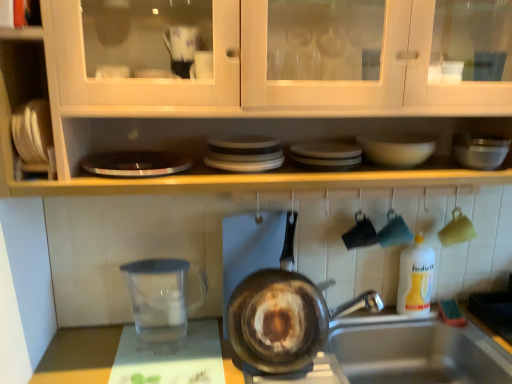
What is the approximate height of rusty metal frying pan at center?

It is 16.28 inches.

This screenshot has width=512, height=384. I want to click on rusty metal frying pan at center, so click(276, 298).

Locate an element on the screen. This screenshot has width=512, height=384. white plastic bottle at right is located at coordinates (415, 278).

This screenshot has height=384, width=512. What are the coordinates of `silver metallic sink at lower right` in the screenshot? It's located at (418, 353).

Locate an element on the screen. The width and height of the screenshot is (512, 384). metallic silver mixing bowl at upper right is located at coordinates 480,150.

What do you see at coordinates (164, 296) in the screenshot? I see `transparent plastic measuring cup at lower left` at bounding box center [164, 296].

Locate an element on the screen. The height and width of the screenshot is (384, 512). transparent plastic measuring cup at lower left is located at coordinates (164, 296).

Locate an element on the screen. This screenshot has height=384, width=512. transparent glass water at lower left is located at coordinates (79, 356).

Locate an element on the screen. white glossy bowl at upper center is located at coordinates (397, 148).

Identify the location of rusty metal frying pan at center. (276, 298).

Looking at this image, which is correct: silver metallic sink at lower right is inside transparent glass water at lower left, or outside of it?

silver metallic sink at lower right is not inside transparent glass water at lower left, it's outside.

Is silver metallic sink at lower right touching transparent glass water at lower left?

There is a gap between silver metallic sink at lower right and transparent glass water at lower left.

Which object is further away from the camera taking this photo, silver metallic sink at lower right or transparent glass water at lower left?

transparent glass water at lower left.

From the image's perspective, is silver metallic sink at lower right on transparent glass water at lower left?

No, from the image's perspective, silver metallic sink at lower right is not above transparent glass water at lower left.

Which of these two, white glossy bowl at upper center or transparent plastic measuring cup at lower left, is thinner?

white glossy bowl at upper center is thinner.

Could transparent plastic measuring cup at lower left be considered to be inside white glossy bowl at upper center?

No, transparent plastic measuring cup at lower left is not surrounded by white glossy bowl at upper center.

Does point (405, 145) come behind point (157, 270)?

No, (405, 145) is in front of (157, 270).

From the image's perspective, which object appears higher, transparent plastic measuring cup at lower left or white glossy bowl at upper center?

white glossy bowl at upper center.

From a real-world perspective, which is physically below, transparent plastic measuring cup at lower left or white glossy bowl at upper center?

transparent plastic measuring cup at lower left is physically lower.

Can you confirm if transparent plastic measuring cup at lower left is thinner than white glossy bowl at upper center?

In fact, transparent plastic measuring cup at lower left might be wider than white glossy bowl at upper center.

Does transparent plastic measuring cup at lower left lie behind white glossy bowl at upper center?

No, it is in front of white glossy bowl at upper center.

In the image, is white glossy bowl at upper center positioned in front of or behind transparent glass water at lower left?

Clearly, white glossy bowl at upper center is behind transparent glass water at lower left.

What's the angular difference between white glossy bowl at upper center and transparent glass water at lower left's facing directions?

The facing directions of white glossy bowl at upper center and transparent glass water at lower left are 0.954 degrees apart.

From the image's perspective, which one is positioned lower, white glossy bowl at upper center or transparent glass water at lower left?

transparent glass water at lower left, from the image's perspective.

Locate an element on the screen. The width and height of the screenshot is (512, 384). counter top beneath the white glossy bowl at upper center (from a real-world perspective) is located at coordinates (79, 356).

Is rusty metal frying pan at center oriented away from transparent glass water at lower left?

rusty metal frying pan at center is not turned away from transparent glass water at lower left.

From the image's perspective, is rusty metal frying pan at center on transparent glass water at lower left?

Indeed, from the image's perspective, rusty metal frying pan at center is shown above transparent glass water at lower left.

Is rusty metal frying pan at center not within transparent glass water at lower left?

Yes, rusty metal frying pan at center is outside of transparent glass water at lower left.

Considering the sizes of objects rusty metal frying pan at center and transparent plastic measuring cup at lower left in the image provided, who is thinner, rusty metal frying pan at center or transparent plastic measuring cup at lower left?

Thinner between the two is transparent plastic measuring cup at lower left.

Considering the positions of objects rusty metal frying pan at center and transparent plastic measuring cup at lower left in the image provided, who is behind, rusty metal frying pan at center or transparent plastic measuring cup at lower left?

transparent plastic measuring cup at lower left is further away from the camera.

From a real-world perspective, is rusty metal frying pan at center located higher than transparent plastic measuring cup at lower left?

Yes, from a real-world perspective, rusty metal frying pan at center is over transparent plastic measuring cup at lower left

You are a GUI agent. You are given a task and a screenshot of the screen. Output one action in this format:
    pyautogui.click(x=<x>, y=<y>)
    Task: Click on the frying pan on the right of the transparent plastic measuring cup at lower left
    This screenshot has height=384, width=512.
    Given the screenshot: What is the action you would take?
    pyautogui.click(x=276, y=298)

Locate an element on the screen. counter top located underneath the transparent plastic measuring cup at lower left (from a real-world perspective) is located at coordinates (79, 356).

In the scene shown: Relative to transparent glass water at lower left, is transparent plastic measuring cup at lower left in front or behind?

Visually, transparent plastic measuring cup at lower left is located behind transparent glass water at lower left.

How distant is transparent plastic measuring cup at lower left from transparent glass water at lower left?

They are 7.31 inches apart.

Can transparent glass water at lower left be found inside transparent plastic measuring cup at lower left?

That's incorrect, transparent glass water at lower left is not inside transparent plastic measuring cup at lower left.

Where is `sink that appears below the transparent glass water at lower left (from a real-world perspective)`? sink that appears below the transparent glass water at lower left (from a real-world perspective) is located at coordinates (418, 353).

Find the location of a particular element. The height and width of the screenshot is (384, 512). appliance below the white glossy bowl at upper center (from the image's perspective) is located at coordinates (164, 296).

Looking at the image, which one is located further to rusty metal frying pan at center, transparent glass water at lower left or white glossy bowl at upper center?

The object further to rusty metal frying pan at center is transparent glass water at lower left.

Looking at this image, when comparing their distances from white plastic bottle at right, does white glossy bowl at upper center or silver metallic sink at lower right seem closer?

The object closer to white plastic bottle at right is silver metallic sink at lower right.

Estimate the real-world distances between objects in this image. Which object is further from transparent glass water at lower left, white plastic bottle at right or rusty metal frying pan at center?

Among the two, white plastic bottle at right is located further to transparent glass water at lower left.

Which object lies nearer to the anchor point transparent glass water at lower left, metallic silver mixing bowl at upper right or rusty metal frying pan at center?

rusty metal frying pan at center.

Estimate the real-world distances between objects in this image. Which object is closer to rusty metal frying pan at center, white glossy bowl at upper center or white plastic bottle at right?

white plastic bottle at right is closer to rusty metal frying pan at center.

Looking at the image, which one is located closer to transparent glass water at lower left, rusty metal frying pan at center or transparent plastic measuring cup at lower left?

transparent plastic measuring cup at lower left is positioned closer to the anchor transparent glass water at lower left.

Based on the photo, which object lies further to the anchor point white glossy bowl at upper center, white plastic bottle at right or transparent plastic measuring cup at lower left?

Among the two, transparent plastic measuring cup at lower left is located further to white glossy bowl at upper center.

When comparing their distances from white glossy bowl at upper center, does transparent plastic measuring cup at lower left or transparent glass water at lower left seem closer?

The object closer to white glossy bowl at upper center is transparent plastic measuring cup at lower left.

The height and width of the screenshot is (384, 512). I want to click on frying pan situated between transparent plastic measuring cup at lower left and white glossy bowl at upper center from left to right, so click(x=276, y=298).

Locate an element on the screen. Image resolution: width=512 pixels, height=384 pixels. basin that lies between metallic silver mixing bowl at upper right and silver metallic sink at lower right from top to bottom is located at coordinates (397, 148).

Identify the location of counter top between transparent plastic measuring cup at lower left and white glossy bowl at upper center. The height and width of the screenshot is (384, 512). (79, 356).

Identify the location of basin located between rusty metal frying pan at center and metallic silver mixing bowl at upper right in the left-right direction. The height and width of the screenshot is (384, 512). (397, 148).